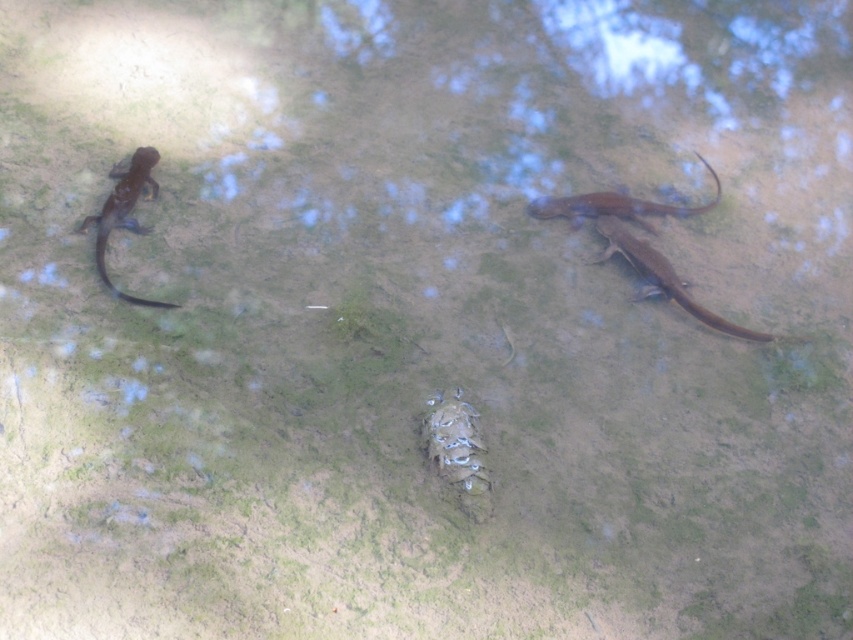
You are a researcher studying salamanders in a shallow pond. You observe a small dark salamander on the left and the brown matte lizard at right. Based on their positions, which salamander is closer to the center of the frame?

The brown matte lizard at right is closer to the center of the frame because its 2D location at point (x=663, y=276) is closer to the center coordinates than the small dark salamander on the left.

You are a wildlife photographer aiming to capture a closeup shot of the brown matte lizard at right. Given that your camera lens has a minimum focusing distance of 10 feet, will you be able to take the photo without moving closer?

The brown matte lizard at right is 8.55 feet away from the viewer, which is within the camera lens minimum focusing distance of 10 feet. Therefore, you can take the photo without moving closer.